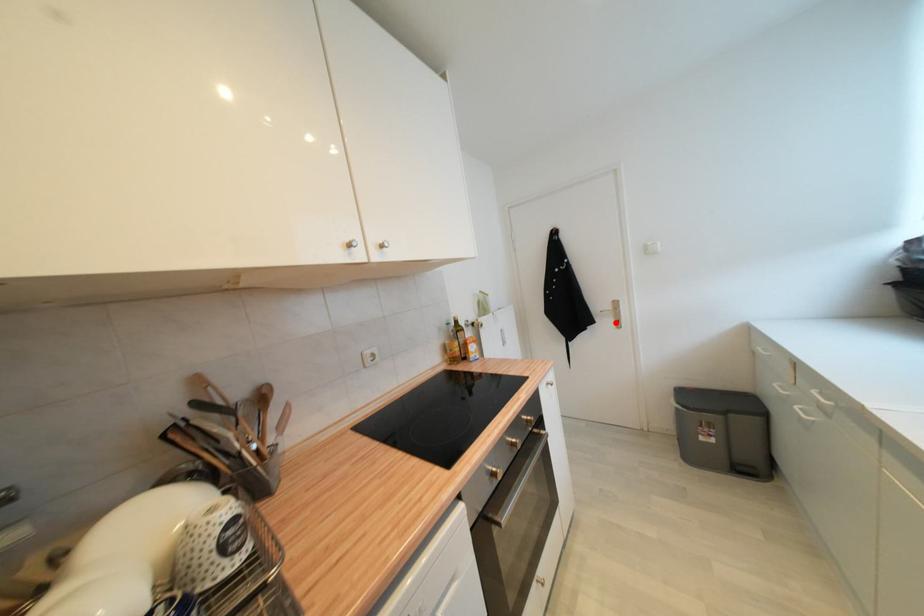
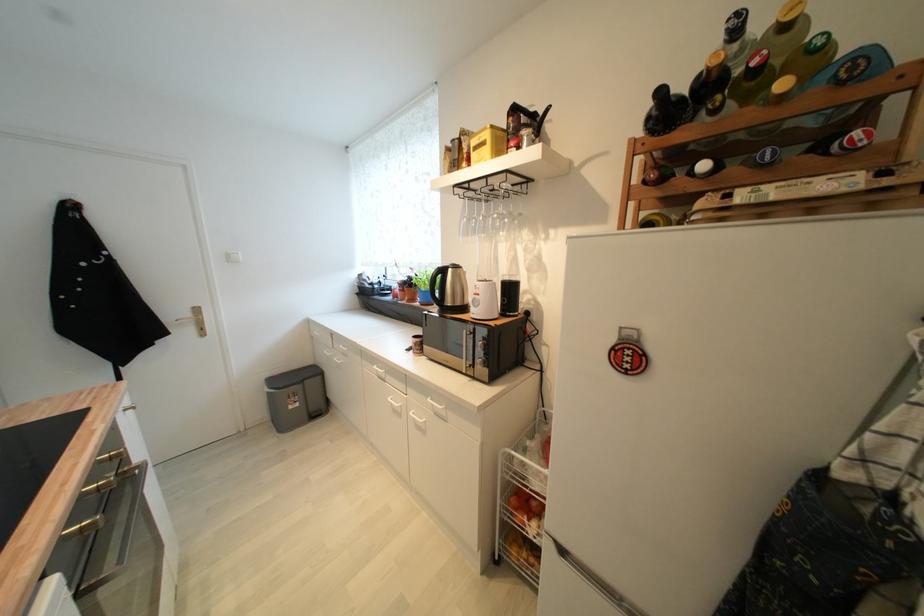
The point at the highlighted location is marked in the first image. Where is the corresponding point in the second image?

(197, 331)